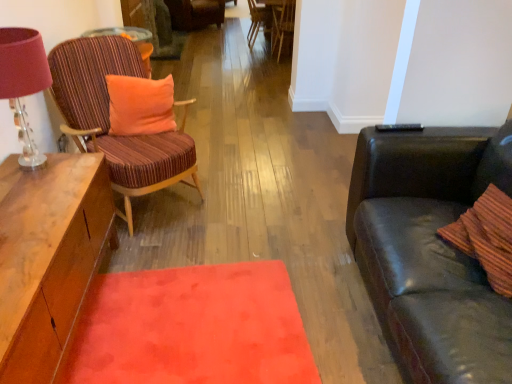
At what (x,y) coordinates should I click in order to perform the action: click on vacant space to the left of wooden chair at center, the second chair viewed from the top. Please return your answer as a coordinate pair (x, y). Looking at the image, I should click on (221, 49).